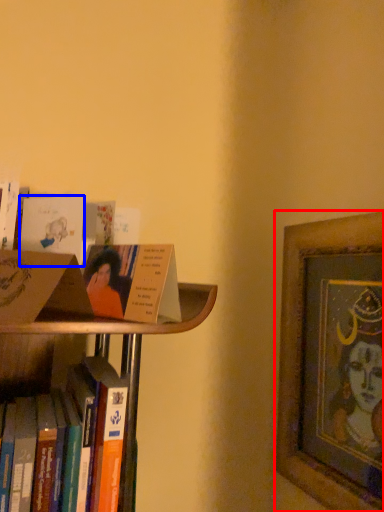
Question: Which object is closer to the camera taking this photo, picture frame (highlighted by a red box) or paperback book (highlighted by a blue box)?

Choices:
 (A) picture frame
 (B) paperback book

Answer: (B)